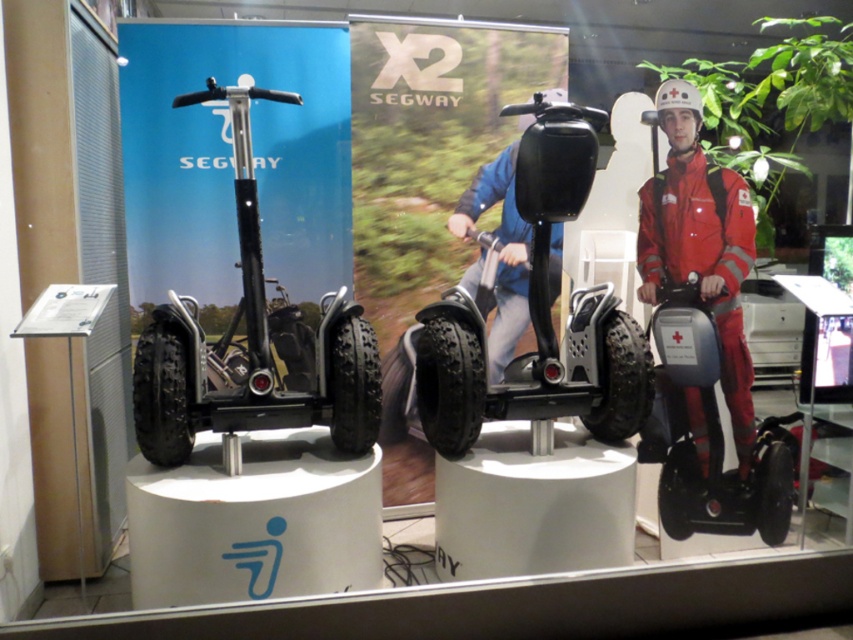
From the picture: What are the coordinates of the black rubber segway at center?

The coordinates of the black rubber segway at center are at point (x=537, y=316).

You are a delivery robot that needs to pass between the black rubber segway at center and the red matte segway at right. The robot is 1.2 meters wide. Can you fit through the space between them?

The black rubber segway at center might be wider than the red matte segway at right, so the space between them could be narrower than expected. Since the robot is 1.2 meters wide, it might not fit through the space between them if the width difference reduces the available passage.

You are standing in front of the Segway display. If you want to reach the black matte segway at left, which direction should you move relative to your current position?

Since the black matte segway at left is positioned at coordinates point (252,346), you should move towards the left side of the display to reach it.